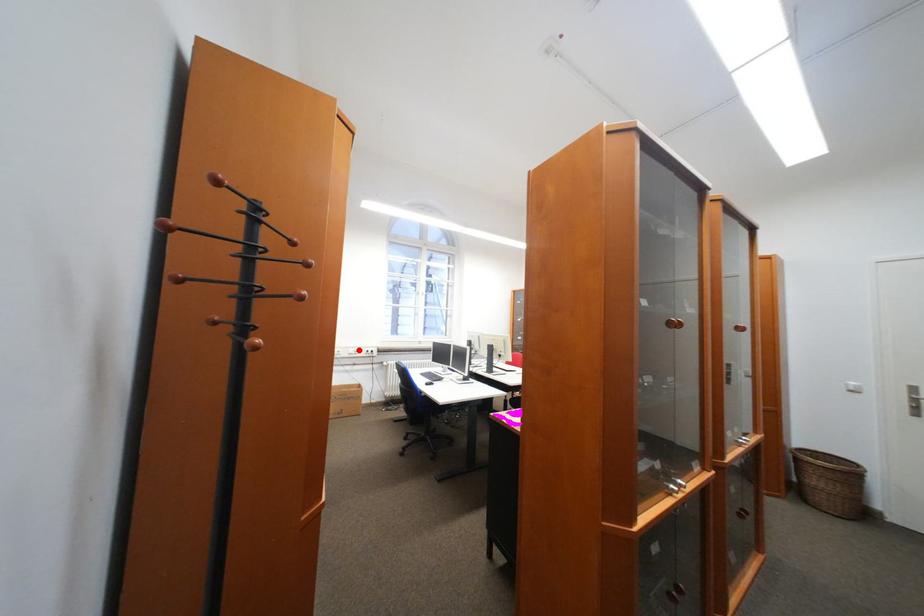
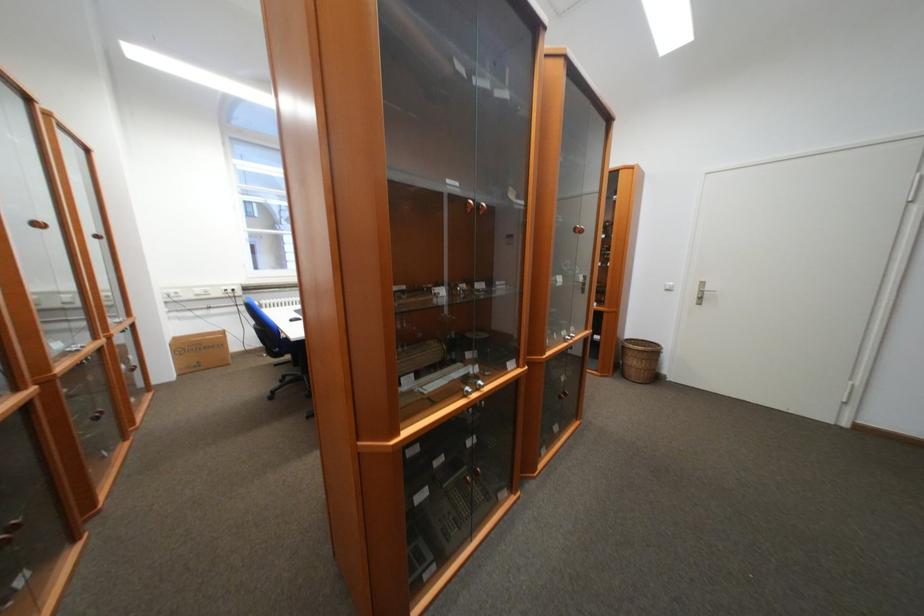
Question: I am providing you with two images of the same scene from different viewpoints. A red point is shown in image1. For the corresponding object point in image2, is it positioned nearer or farther from the camera?

Choices:
 (A) Nearer
 (B) Farther

Answer: (A)